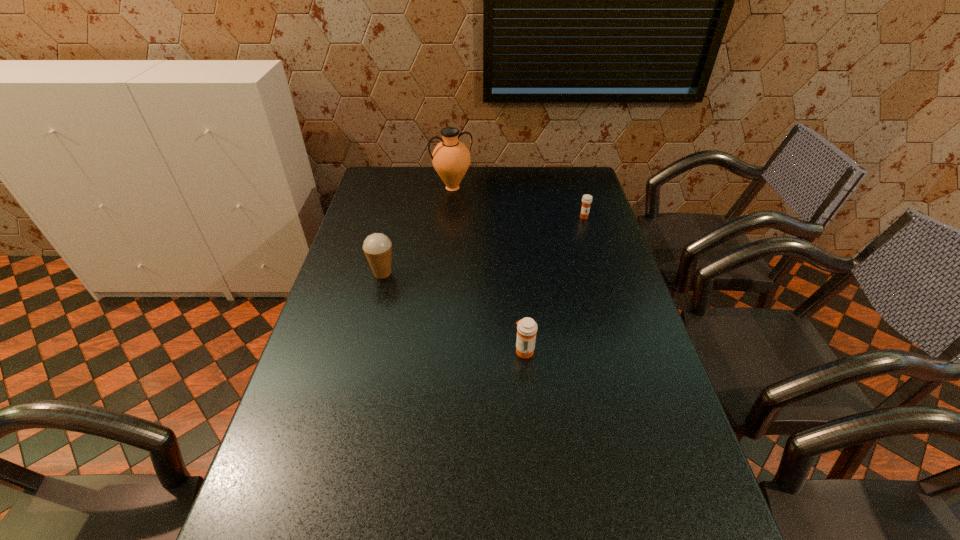
This screenshot has height=540, width=960. What are the coordinates of `vacant area that lies between the farther medicine and the pitcher` in the screenshot? It's located at (518, 202).

This screenshot has height=540, width=960. Identify the location of vacant area that lies between the leftmost object and the nearest object. (453, 312).

Identify the location of free area in between the second object from left to right and the left medicine. This screenshot has height=540, width=960. (489, 269).

Identify which object is located as the second nearest to the shortest object. Please provide its 2D coordinates. Your answer should be formatted as a tuple, i.e. [(x, y)], where the tuple contains the x and y coordinates of a point satisfying the conditions above.

[(527, 328)]

Select which object appears as the second closest to the second shortest object. Please provide its 2D coordinates. Your answer should be formatted as a tuple, i.e. [(x, y)], where the tuple contains the x and y coordinates of a point satisfying the conditions above.

[(586, 199)]

This screenshot has height=540, width=960. In order to click on medicine that can be found as the closest to the tallest object in this screenshot , I will do `click(586, 199)`.

Where is `vacant space that satisfies the following two spatial constraints: 1. on the front side of the farthest object; 2. on the right side of the nearer medicine`? vacant space that satisfies the following two spatial constraints: 1. on the front side of the farthest object; 2. on the right side of the nearer medicine is located at coordinates (438, 350).